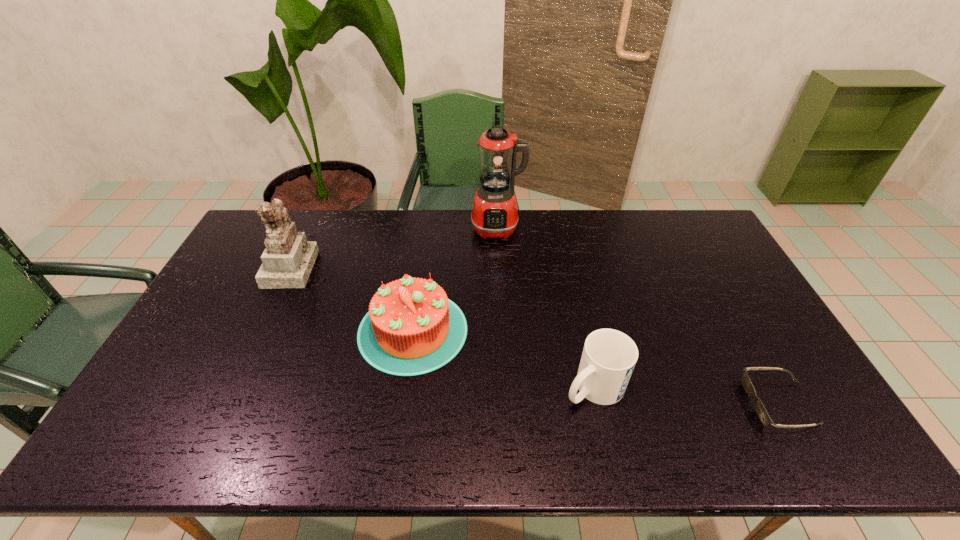
Locate an element on the screen. This screenshot has width=960, height=540. vacant area located on the controls of the tallest object is located at coordinates (500, 275).

Identify the location of vacant space located on the front-facing side of the leftmost object. (403, 267).

Find the location of a particular element. Image resolution: width=960 pixels, height=540 pixels. free space located on the right of the cake is located at coordinates (575, 330).

What are the coordinates of `vacant position located on the left of the second object from right to left` in the screenshot? It's located at (419, 387).

Where is `vacant area located 0.330m on the front-facing side of the rightmost object`? vacant area located 0.330m on the front-facing side of the rightmost object is located at coordinates (617, 403).

Locate an element on the screen. The width and height of the screenshot is (960, 540). free space located 0.070m on the front-facing side of the rightmost object is located at coordinates (722, 403).

Find the location of `vacant region located on the front-facing side of the rightmost object`. vacant region located on the front-facing side of the rightmost object is located at coordinates (726, 403).

The image size is (960, 540). In order to click on food processor at the far edge in this screenshot , I will do `click(494, 214)`.

Where is `figurine that is at the far edge`? This screenshot has height=540, width=960. figurine that is at the far edge is located at coordinates (287, 261).

Where is `object present at the near edge`? Image resolution: width=960 pixels, height=540 pixels. object present at the near edge is located at coordinates (761, 411).